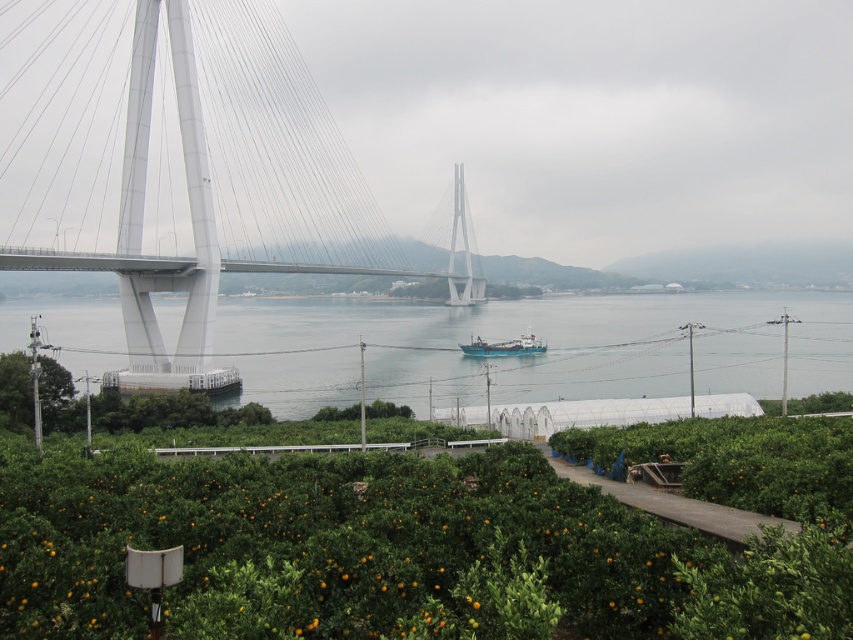
Question: Considering the real-world distances, which object is farthest from the white metallic suspension bridge at left?

Choices:
 (A) blue matte boat at center
 (B) clear water at center

Answer: (A)

Question: Which point is closer to the camera?

Choices:
 (A) (477, 355)
 (B) (834, 353)

Answer: (A)

Question: Which of the following is the farthest from the observer?

Choices:
 (A) clear water at center
 (B) white metallic suspension bridge at left

Answer: (B)

Question: From the image, what is the correct spatial relationship of white metallic suspension bridge at left in relation to clear water at center?

Choices:
 (A) right
 (B) left

Answer: (B)

Question: Is white metallic suspension bridge at left bigger than clear water at center?

Choices:
 (A) yes
 (B) no

Answer: (A)

Question: Is clear water at center above blue matte boat at center?

Choices:
 (A) no
 (B) yes

Answer: (B)